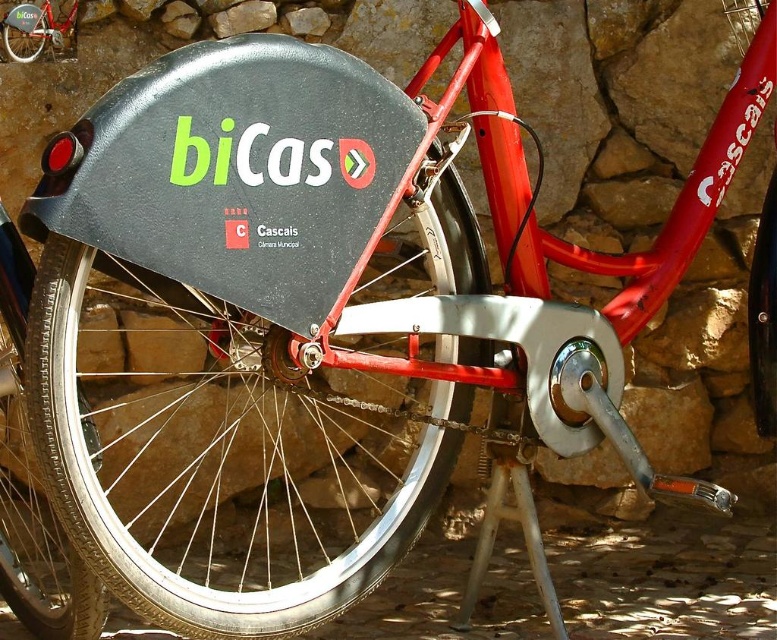
You are a delivery person who needs to place a box between the black rubber tire at lower left and the black rubber tire at lower right. Can you fit the box there?

The black rubber tire at lower left is in front of the black rubber tire at lower right, so there is space between them to place the box.

You are a delivery person trying to load this bicycle onto a truck. The truck has a loading ramp that can only accommodate items up to 1.2 meters in height. Based on the image, will the black rubber tire at center and the black rubber tire at lower left fit through the ramp without any issues?

The black rubber tire at center is much taller than the black rubber tire at lower left. Since the taller tire is the black rubber tire at center, and the maximum height allowed is 1.2 meters, we need to ensure its height does not exceed this limit. However, without specific measurements, it is impossible to confirm if it will fit. Please measure the height of the black rubber tire at center before loading.

You are standing 1.5 meters away from the rear wheel of the red bicycle. Can you reach the point at coordinate point [2,584] on the rear wheel?

The point at coordinate point [2,584] is 1.47 meters from the camera, so you are 1.5 meters away from the rear wheel. Since the distance between you and the point is approximately the same, you can likely reach it.